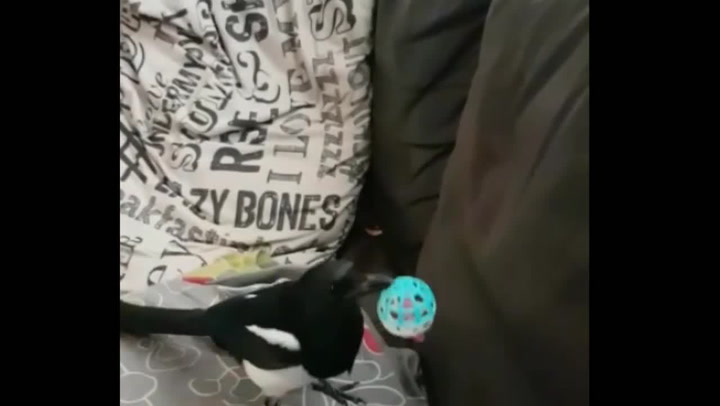
Where is `white blanket with text pattern`? The image size is (720, 406). white blanket with text pattern is located at coordinates (253, 172).